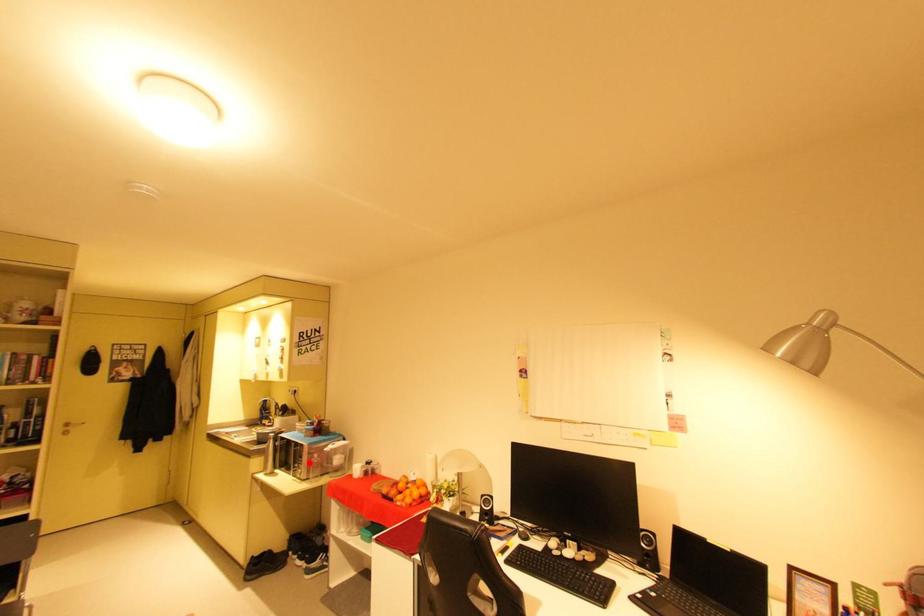
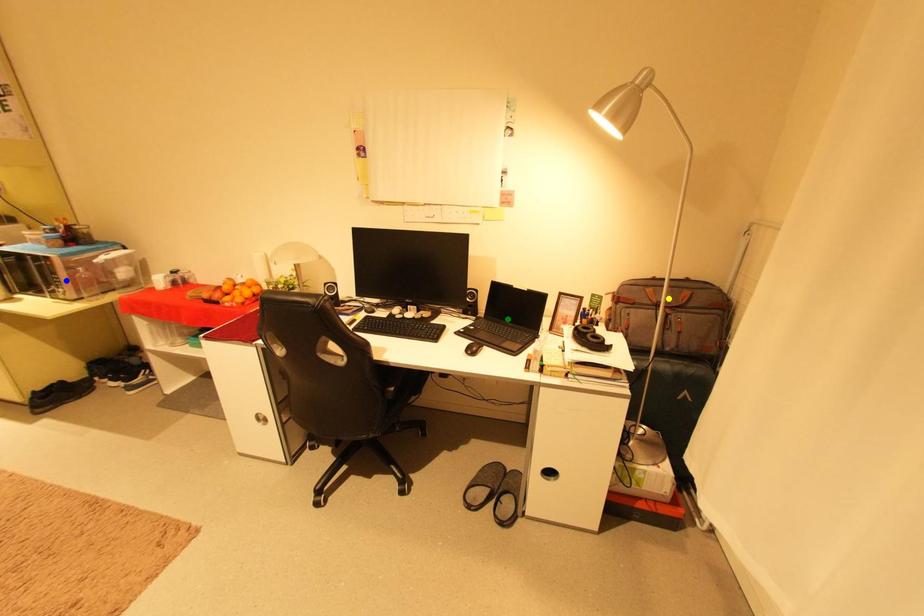
Question: I am providing you with two images of the same scene from different viewpoints. A red point is marked on the first image. You are given multiple points on the second image. Can you choose the point in image 2 that corresponds to the point in image 1?

Choices:
 (A) yellow point
 (B) green point
 (C) blue point

Answer: (C)